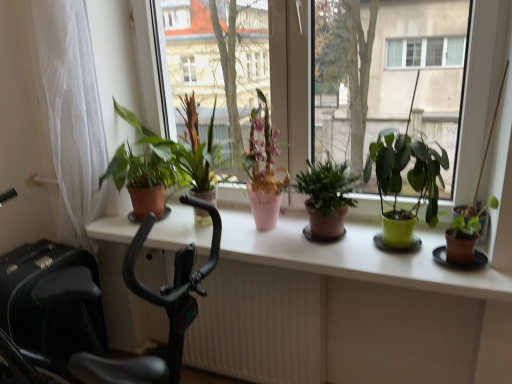
This screenshot has width=512, height=384. I want to click on vacant area situated below green matte plant at center, which is counted as the second houseplant, starting from the right (from a real-world perspective), so click(x=403, y=251).